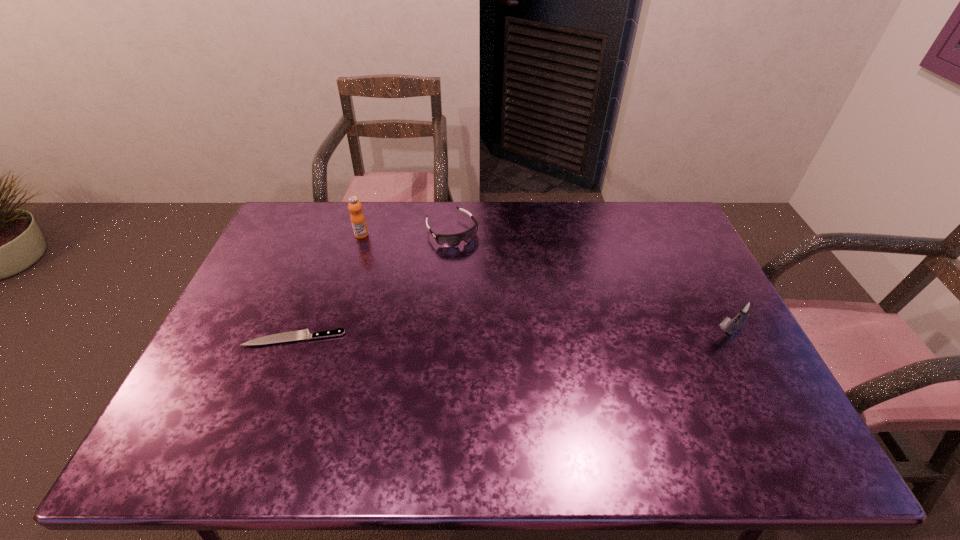
You are a GUI agent. You are given a task and a screenshot of the screen. Output one action in this format:
    pyautogui.click(x=<x>, y=<y>)
    Task: Click on the free space between the rightmost object and the shortest object
    
    Given the screenshot: What is the action you would take?
    pyautogui.click(x=511, y=336)

Where is `vacant area between the igniter and the third object from left to right`? vacant area between the igniter and the third object from left to right is located at coordinates (589, 282).

Locate an element on the screen. free space between the third shortest object and the third object from left to right is located at coordinates (589, 282).

Locate an element on the screen. The width and height of the screenshot is (960, 540). vacant area that lies between the rightmost object and the orange juice is located at coordinates (544, 285).

Locate an element on the screen. This screenshot has height=540, width=960. object that stands as the third closest to the steak knife is located at coordinates (747, 308).

Identify which object is located as the second nearest to the second tallest object. Please provide its 2D coordinates. Your answer should be formatted as a tuple, i.e. [(x, y)], where the tuple contains the x and y coordinates of a point satisfying the conditions above.

[(299, 334)]

Locate an element on the screen. The height and width of the screenshot is (540, 960). free space that satisfies the following two spatial constraints: 1. on the back side of the steak knife; 2. on the right side of the third shortest object is located at coordinates (296, 334).

Find the location of `vacant region that satisfies the following two spatial constraints: 1. on the back side of the second object from right to left; 2. on the left side of the steak knife`. vacant region that satisfies the following two spatial constraints: 1. on the back side of the second object from right to left; 2. on the left side of the steak knife is located at coordinates (335, 231).